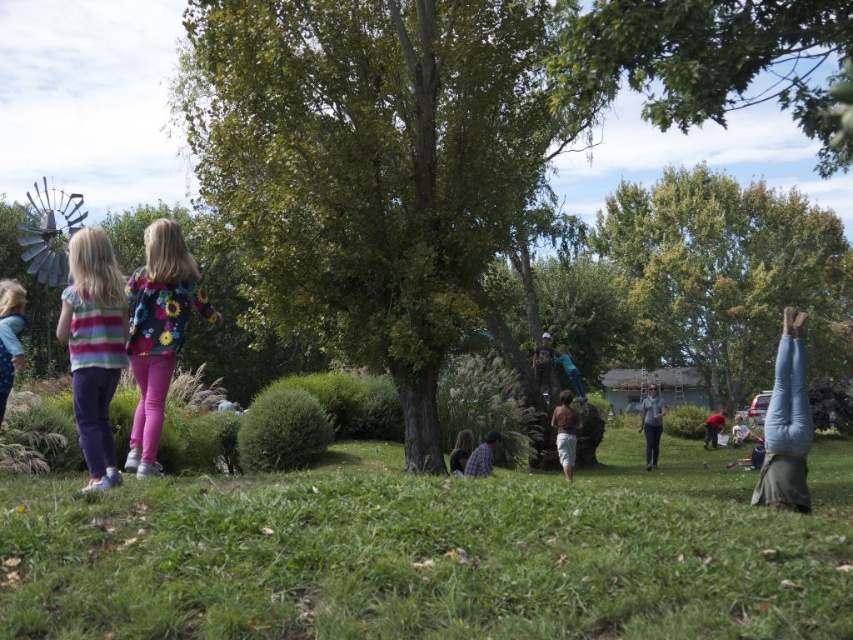
Question: Is floral shirt at center closer to the viewer compared to camouflage fabric backpack at center?

Choices:
 (A) yes
 (B) no

Answer: (A)

Question: Estimate the real-world distances between objects in this image. Which object is farther from the striped fabric shirt at left?

Choices:
 (A) floral shirt at center
 (B) red fabric pants at lower right
 (C) green leafy tree at upper center
 (D) green leafy tree at upper right

Answer: (D)

Question: Is green grassy at lower center smaller than floral shirt at center?

Choices:
 (A) yes
 (B) no

Answer: (A)

Question: Based on their relative distances, which object is farther from the striped fabric shirt at left?

Choices:
 (A) jeans at lower right
 (B) plaid shirt at center
 (C) brown cotton shirt at center

Answer: (C)

Question: Which object is positioned farthest from the green leafy tree at upper center?

Choices:
 (A) brown cotton shirt at center
 (B) green leafy tree at upper right

Answer: (A)

Question: Does striped fabric shirt at left have a greater width compared to plaid shirt at center?

Choices:
 (A) yes
 (B) no

Answer: (A)